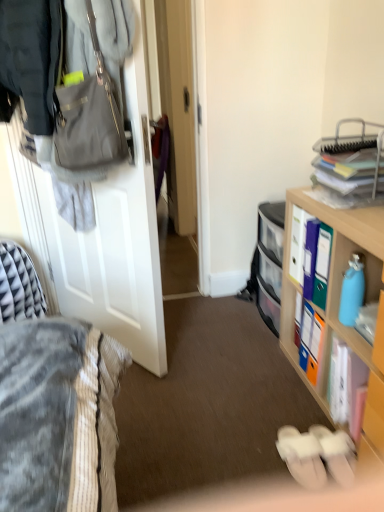
At what (x,y) coordinates should I click in order to perform the action: click on free space between white matte door at left and white fabric slippers at lower center, the first footwear positioned from the right. Please return your answer as a coordinate pair (x, y). Looking at the image, I should click on (218, 402).